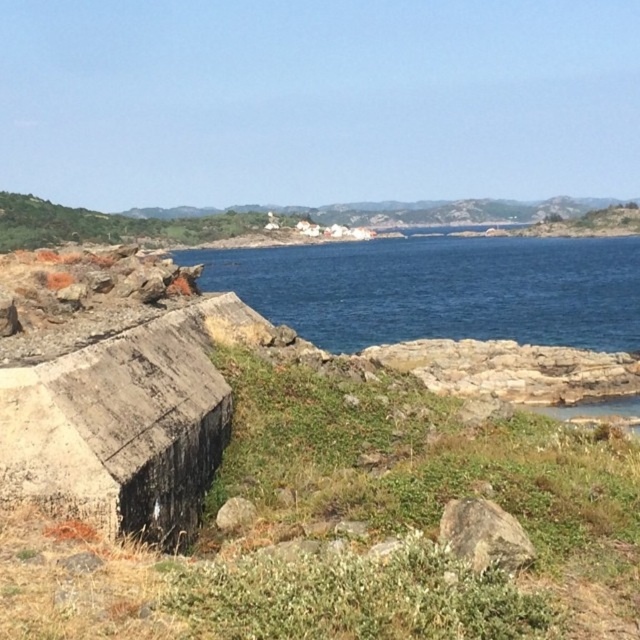
Question: Which of these objects is positioned farthest from the blue water at center?

Choices:
 (A) gray rough stone at center
 (B) brown rough rock at center

Answer: (A)

Question: Does blue water at center have a lesser width compared to gray rough stone at center?

Choices:
 (A) yes
 (B) no

Answer: (B)

Question: Is blue water at center further to camera compared to gray rough stone at center?

Choices:
 (A) yes
 (B) no

Answer: (A)

Question: Among these objects, which one is farthest from the camera?

Choices:
 (A) brown rough rock at center
 (B) blue water at center

Answer: (B)

Question: Does brown rough rock at center have a larger size compared to gray rough stone at center?

Choices:
 (A) no
 (B) yes

Answer: (B)

Question: Which of the following is the farthest from the observer?

Choices:
 (A) (221, 515)
 (B) (508, 563)

Answer: (A)